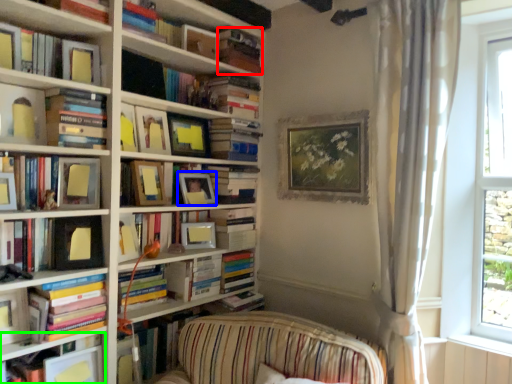
Question: Considering the real-world distances, which object is closest to book (highlighted by a red box)? picture frame (highlighted by a blue box) or book (highlighted by a green box).

Choices:
 (A) picture frame
 (B) book

Answer: (A)